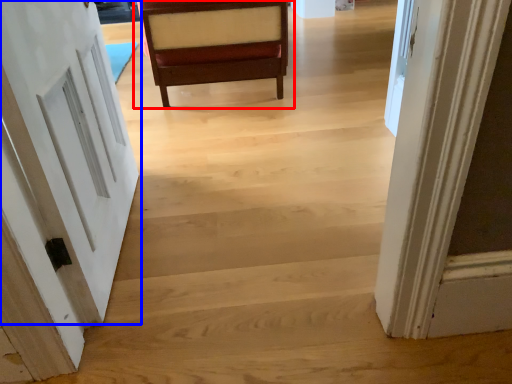
Question: Which of the following is the closest to the observer, chair (highlighted by a red box) or door (highlighted by a blue box)?

Choices:
 (A) chair
 (B) door

Answer: (B)